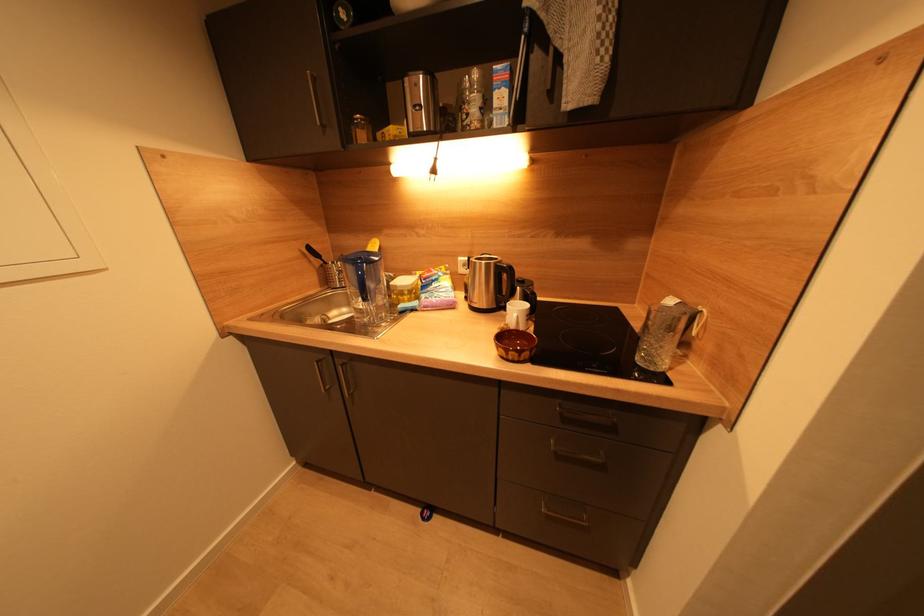
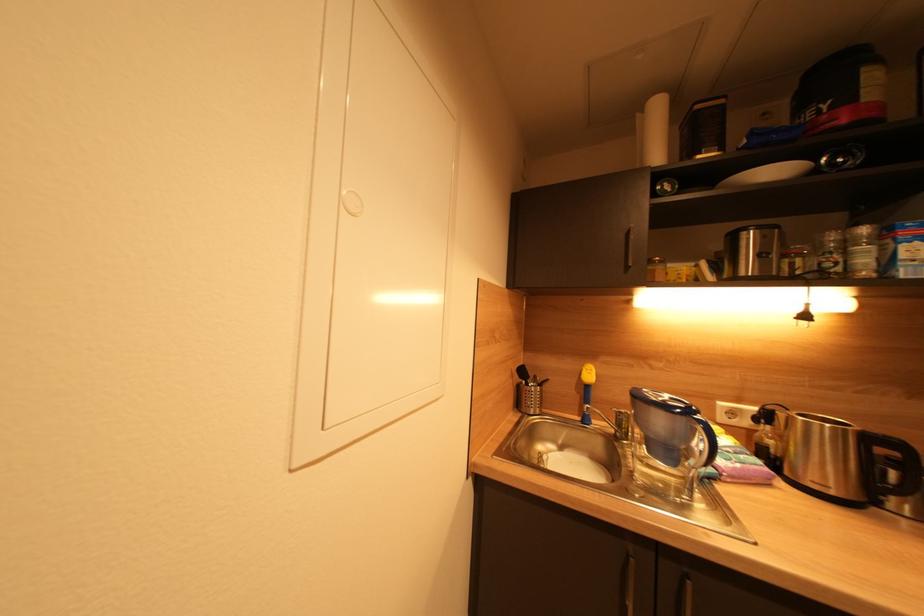
Question: What movement of the cameraman would produce the second image?

Choices:
 (A) Left
 (B) Right
 (C) Forward
 (D) Backward

Answer: (A)